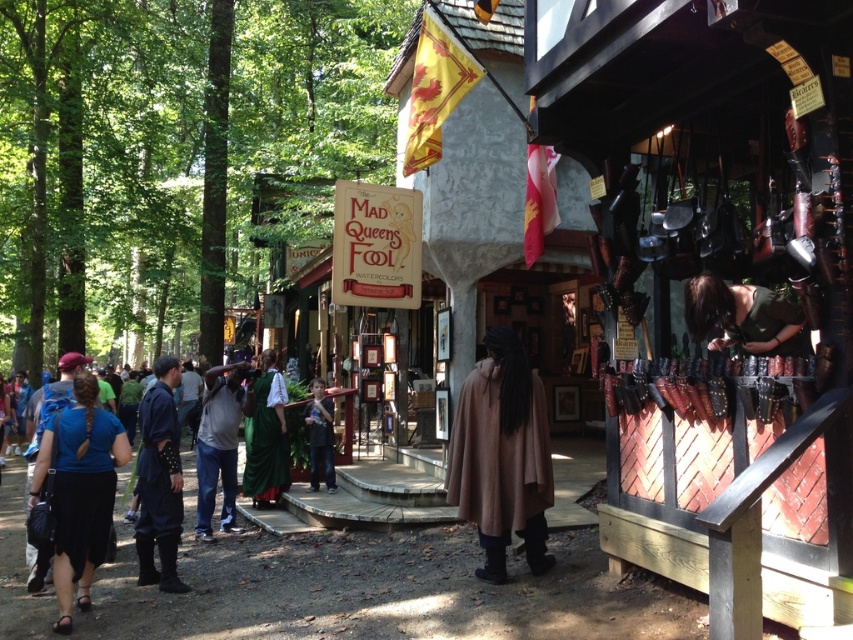
Is green matte shirt at upper right bigger than green velvet dress at center?

No, green matte shirt at upper right is not bigger than green velvet dress at center.

Between point (712, 300) and point (268, 422), which one is positioned behind?

Point (268, 422)

Where is `green matte shirt at upper right`? The width and height of the screenshot is (853, 640). green matte shirt at upper right is located at coordinates coord(741,316).

Can you confirm if beige wool cape at center is positioned below green velvet dress at center?

Actually, beige wool cape at center is above green velvet dress at center.

Does beige wool cape at center appear on the right side of green velvet dress at center?

Indeed, beige wool cape at center is positioned on the right side of green velvet dress at center.

Between point (457, 497) and point (258, 460), which one is positioned in front?

Point (457, 497)

Where is `beige wool cape at center`? This screenshot has width=853, height=640. beige wool cape at center is located at coordinates (502, 456).

Is dark blue fabric coat at center thinner than matte brown leather bag at center?

No, dark blue fabric coat at center is not thinner than matte brown leather bag at center.

The image size is (853, 640). What do you see at coordinates (160, 481) in the screenshot? I see `dark blue fabric coat at center` at bounding box center [160, 481].

You are a GUI agent. You are given a task and a screenshot of the screen. Output one action in this format:
    pyautogui.click(x=<x>, y=<y>)
    Task: Click on the dark blue fabric coat at center
    This screenshot has width=853, height=640.
    Given the screenshot: What is the action you would take?
    pyautogui.click(x=160, y=481)